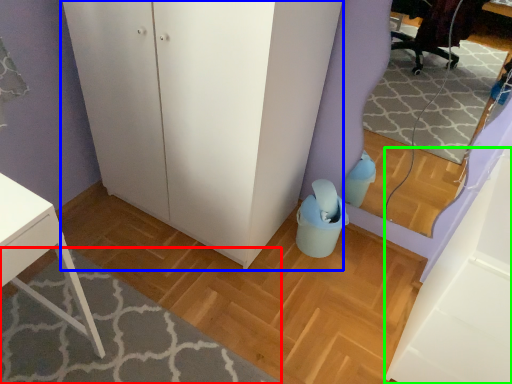
Question: Which object is the farthest from plain (highlighted by a red box)? Choose among these: dresser (highlighted by a blue box) or cabinetry (highlighted by a green box).

Choices:
 (A) dresser
 (B) cabinetry

Answer: (B)